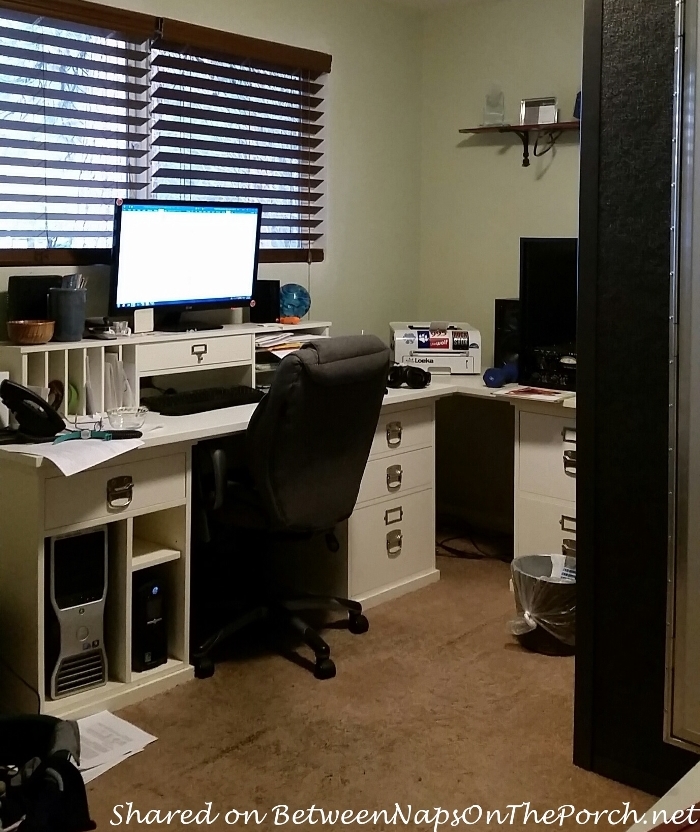
The width and height of the screenshot is (700, 832). What are the coordinates of `trash can` in the screenshot? It's located at (542, 597).